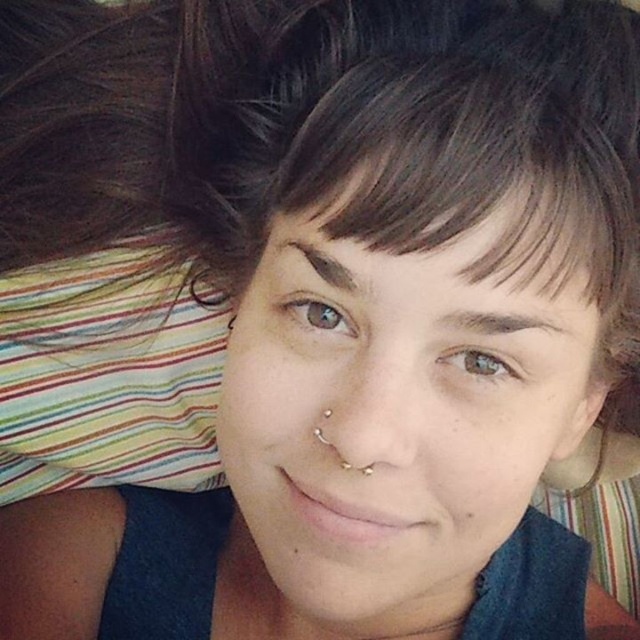
Is smooth skin face at center closer to camera compared to brown matte hair at center?

No, smooth skin face at center is further to the viewer.

Can you confirm if smooth skin face at center is thinner than brown matte hair at center?

In fact, smooth skin face at center might be wider than brown matte hair at center.

At what (x,y) coordinates should I click in order to perform the action: click on smooth skin face at center. Please return your answer as a coordinate pair (x, y). Looking at the image, I should click on (390, 417).